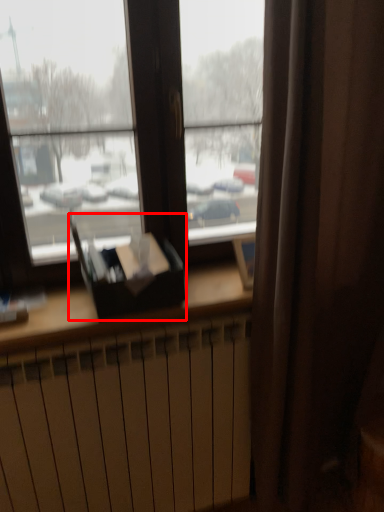
Question: From the image's perspective, considering the relative positions of paperback book (annotated by the red box) and radiator in the image provided, where is paperback book (annotated by the red box) located with respect to the staircase?

Choices:
 (A) above
 (B) below

Answer: (A)